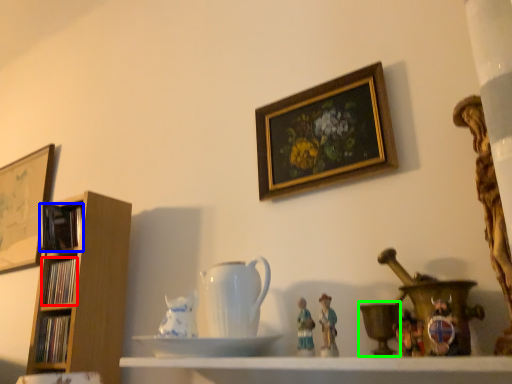
Question: Estimate the real-world distances between objects in this image. Which object is closer to book (highlighted by a red box), book (highlighted by a blue box) or candle holder (highlighted by a green box)?

Choices:
 (A) book
 (B) candle holder

Answer: (A)